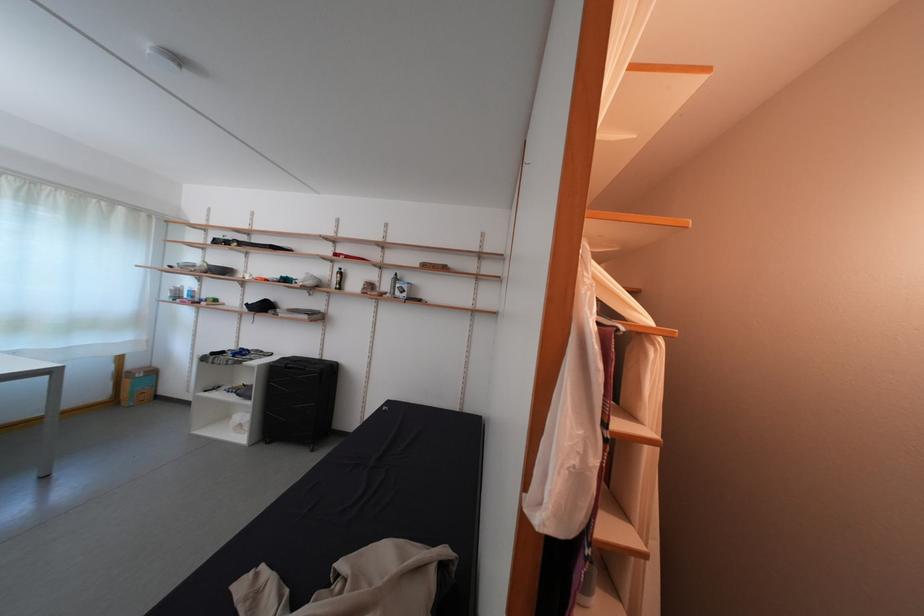
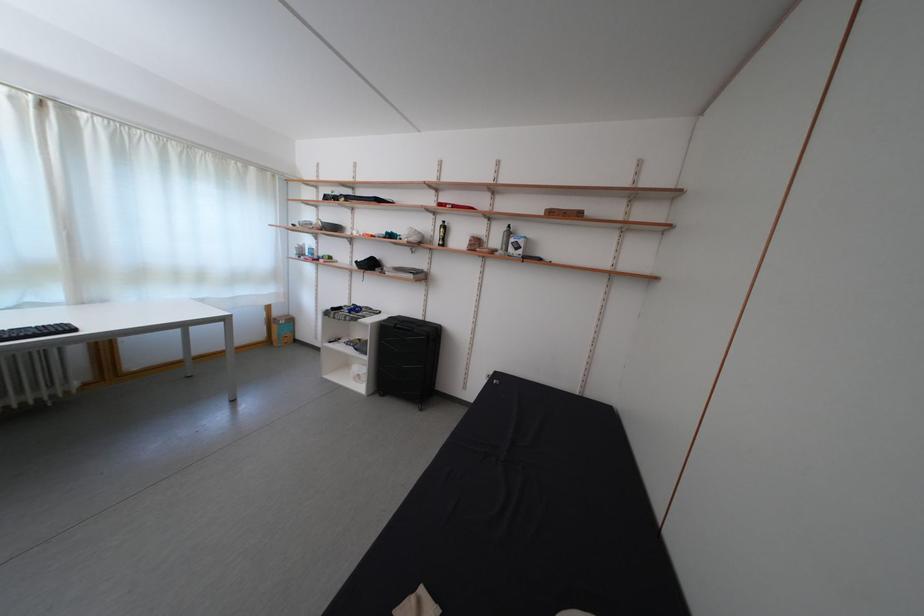
In the second image, find the point that corresponds to point 140,371 in the first image.

(285, 320)